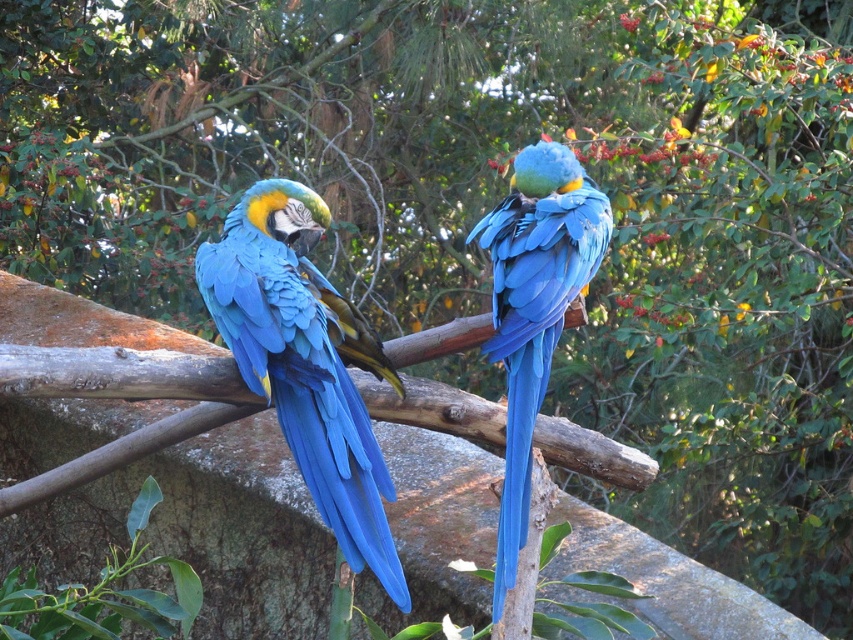
You are a birdwatcher observing two blue glossy parrots in a tree. You see the blue glossy parrot at left and the blue glossy parrot at center. Which one is positioned to the left of the other?

The blue glossy parrot at left is positioned to the left of the blue glossy parrot at center.

You are a birdwatcher observing two blue glossy parrots in a tree. You notice the blue glossy parrot at left and the blue glossy parrot at center. Which one do you think is larger in size?

The blue glossy parrot at left is bigger than the blue glossy parrot at center.

You are a birdwatcher observing two points in the image where the macaws are perched. The points are labeled as point 1 at coordinates point (273, 241) and point 2 at coordinates point (524, 298). From your vantage point, which point is closer to you?

Point (524, 298) is closer to you because point (273, 241) is behind it.